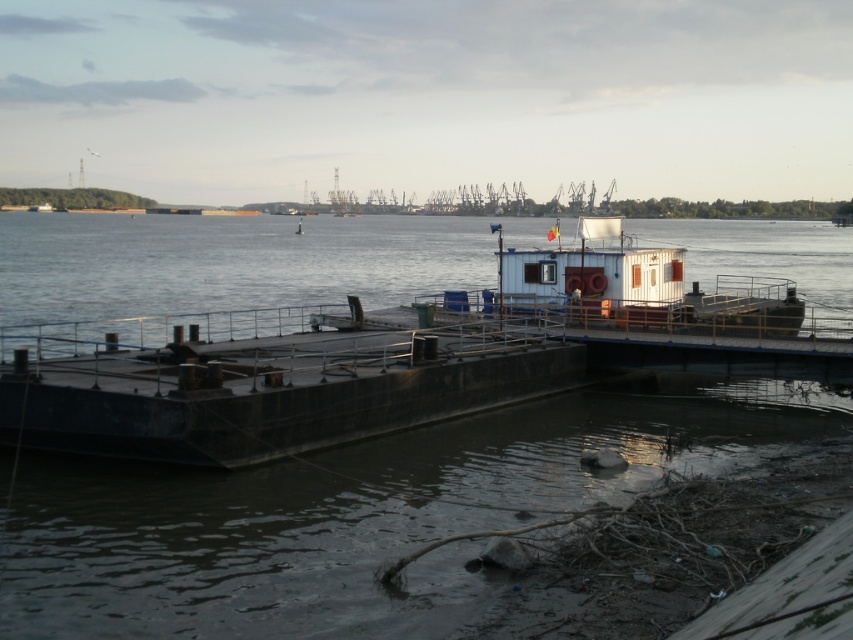
Between brown concrete water at center and dark gray concrete barge at center, which one is positioned higher?

brown concrete water at center is higher up.

Can you confirm if brown concrete water at center is positioned below dark gray concrete barge at center?

Actually, brown concrete water at center is above dark gray concrete barge at center.

Where is `brown concrete water at center`? This screenshot has width=853, height=640. brown concrete water at center is located at coordinates (347, 515).